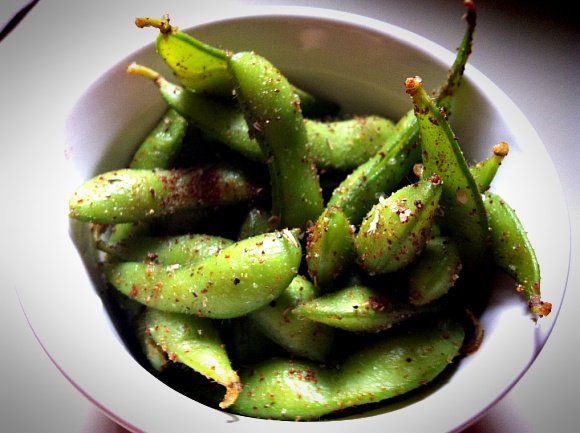
The image size is (580, 433). I want to click on table, so click(x=536, y=89).